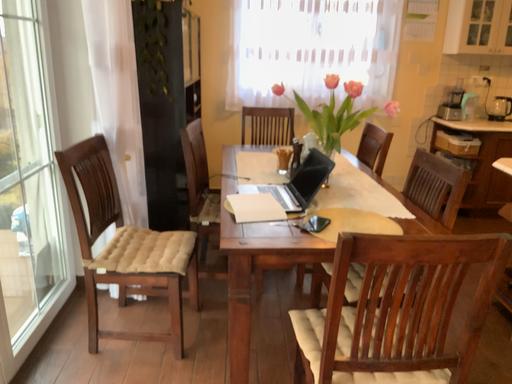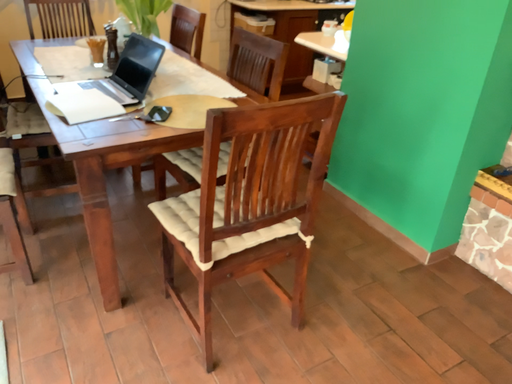
Question: Which way did the camera rotate in the video?

Choices:
 (A) rotated right
 (B) rotated left

Answer: (A)